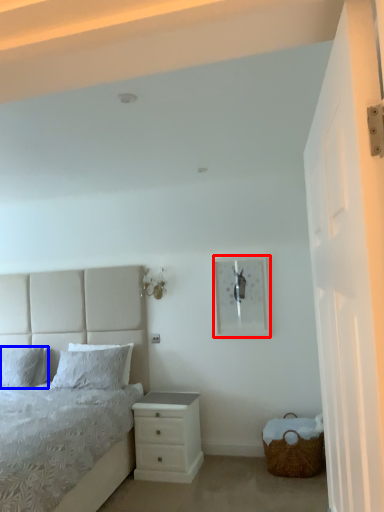
Question: Among these objects, which one is farthest to the camera, picture frame (highlighted by a red box) or pillow (highlighted by a blue box)?

Choices:
 (A) picture frame
 (B) pillow

Answer: (B)